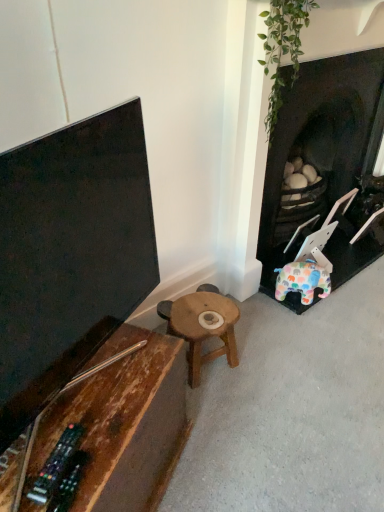
Identify the location of wooden stool at center, the 2th table viewed from the front. (202, 327).

The width and height of the screenshot is (384, 512). What are the coordinates of `dark brown wood fireplace at right` in the screenshot? It's located at (325, 162).

Locate an element on the screen. The width and height of the screenshot is (384, 512). rustic wood table at lower left, marked as the 2th table in a back-to-front arrangement is located at coordinates (122, 425).

Is rustic wood table at lower left, marked as the 2th table in a back-to-front arrangement, positioned far away from dark brown wood fireplace at right?

Absolutely, rustic wood table at lower left, marked as the 2th table in a back-to-front arrangement, is distant from dark brown wood fireplace at right.

Find the location of a particular element. The width and height of the screenshot is (384, 512). fireplace located behind the rustic wood table at lower left, marked as the 2th table in a back-to-front arrangement is located at coordinates (325, 162).

From a real-world perspective, is rustic wood table at lower left, marked as the 2th table in a back-to-front arrangement, physically above dark brown wood fireplace at right?

No, from a real-world perspective, rustic wood table at lower left, marked as the 2th table in a back-to-front arrangement, is not on top of dark brown wood fireplace at right.

Between rustic wood table at lower left, marked as the 2th table in a back-to-front arrangement, and dark brown wood fireplace at right, which one has larger size?

dark brown wood fireplace at right is bigger.

From the image's perspective, is rustic wood table at lower left, the first table in the front-to-back sequence, over wooden stool at center, the 2th table viewed from the front?

No, from the image's perspective, rustic wood table at lower left, the first table in the front-to-back sequence, is not above wooden stool at center, the 2th table viewed from the front.

Can wooden stool at center, the 1th table viewed from the back, be found inside rustic wood table at lower left, the first table in the front-to-back sequence?

That's incorrect, wooden stool at center, the 1th table viewed from the back, is not inside rustic wood table at lower left, the first table in the front-to-back sequence.

Are rustic wood table at lower left, marked as the 2th table in a back-to-front arrangement, and wooden stool at center, the 2th table viewed from the front, far apart?

No, rustic wood table at lower left, marked as the 2th table in a back-to-front arrangement, is in close proximity to wooden stool at center, the 2th table viewed from the front.

Considering the sizes of rustic wood table at lower left, marked as the 2th table in a back-to-front arrangement, and wooden stool at center, the 2th table viewed from the front, in the image, is rustic wood table at lower left, marked as the 2th table in a back-to-front arrangement, wider or thinner than wooden stool at center, the 2th table viewed from the front,?

Considering their sizes, rustic wood table at lower left, marked as the 2th table in a back-to-front arrangement, looks broader than wooden stool at center, the 2th table viewed from the front.

Considering the sizes of objects wooden stool at center, the 2th table viewed from the front, and rustic wood table at lower left, marked as the 2th table in a back-to-front arrangement, in the image provided, who is smaller, wooden stool at center, the 2th table viewed from the front, or rustic wood table at lower left, marked as the 2th table in a back-to-front arrangement,?

With smaller size is wooden stool at center, the 2th table viewed from the front.

In the image, there is a rustic wood table at lower left, marked as the 2th table in a back-to-front arrangement. What are the coordinates of `table below it (from a real-world perspective)` in the screenshot? It's located at (202, 327).

From the image's perspective, which object appears higher, wooden stool at center, the 2th table viewed from the front, or rustic wood table at lower left, the first table in the front-to-back sequence?

wooden stool at center, the 2th table viewed from the front, appears higher in the image.

From the picture: Is wooden stool at center, the 2th table viewed from the front, oriented away from rustic wood table at lower left, the first table in the front-to-back sequence?

wooden stool at center, the 2th table viewed from the front, does not have its back to rustic wood table at lower left, the first table in the front-to-back sequence.

Looking at this image, is dark brown wood fireplace at right not within wooden stool at center, the 2th table viewed from the front?

Absolutely, dark brown wood fireplace at right is external to wooden stool at center, the 2th table viewed from the front.

Based on the photo, between dark brown wood fireplace at right and wooden stool at center, the 2th table viewed from the front, which one has larger width?

dark brown wood fireplace at right is wider.

Is the position of dark brown wood fireplace at right more distant than that of wooden stool at center, the 2th table viewed from the front?

No, it is in front of wooden stool at center, the 2th table viewed from the front.

From a real-world perspective, who is located lower, dark brown wood fireplace at right or wooden stool at center, the 2th table viewed from the front?

wooden stool at center, the 2th table viewed from the front, is physically lower.

From the image's perspective, is dark brown wood fireplace at right located beneath rustic wood table at lower left, marked as the 2th table in a back-to-front arrangement?

No.

Is dark brown wood fireplace at right surrounding rustic wood table at lower left, the first table in the front-to-back sequence?

No, rustic wood table at lower left, the first table in the front-to-back sequence, is located outside of dark brown wood fireplace at right.

Relative to rustic wood table at lower left, the first table in the front-to-back sequence, is dark brown wood fireplace at right in front or behind?

Visually, dark brown wood fireplace at right is located behind rustic wood table at lower left, the first table in the front-to-back sequence.

Which object is positioned more to the left, dark brown wood fireplace at right or rustic wood table at lower left, the first table in the front-to-back sequence?

From the viewer's perspective, rustic wood table at lower left, the first table in the front-to-back sequence, appears more on the left side.

From the image's perspective, which one is positioned higher, wooden stool at center, the 2th table viewed from the front, or dark brown wood fireplace at right?

dark brown wood fireplace at right appears higher in the image.

Who is smaller, wooden stool at center, the 1th table viewed from the back, or dark brown wood fireplace at right?

wooden stool at center, the 1th table viewed from the back, is smaller.

Looking at this image, between wooden stool at center, the 1th table viewed from the back, and dark brown wood fireplace at right, which one is positioned in front?

dark brown wood fireplace at right is in front.

The image size is (384, 512). In order to click on fireplace above the rustic wood table at lower left, marked as the 2th table in a back-to-front arrangement (from the image's perspective) in this screenshot , I will do `click(325, 162)`.

You are a GUI agent. You are given a task and a screenshot of the screen. Output one action in this format:
    pyautogui.click(x=<x>, y=<y>)
    Task: Click on the table in front of the wooden stool at center, the 1th table viewed from the back
    The image size is (384, 512).
    Given the screenshot: What is the action you would take?
    pyautogui.click(x=122, y=425)

Looking at the image, which one is located further to rustic wood table at lower left, marked as the 2th table in a back-to-front arrangement, wooden stool at center, the 2th table viewed from the front, or dark brown wood fireplace at right?

dark brown wood fireplace at right.

Looking at this image, when comparing their distances from dark brown wood fireplace at right, does wooden stool at center, the 1th table viewed from the back, or rustic wood table at lower left, the first table in the front-to-back sequence, seem further?

rustic wood table at lower left, the first table in the front-to-back sequence, is further to dark brown wood fireplace at right.

Which object lies nearer to the anchor point wooden stool at center, the 2th table viewed from the front, rustic wood table at lower left, marked as the 2th table in a back-to-front arrangement, or dark brown wood fireplace at right?

The object closer to wooden stool at center, the 2th table viewed from the front, is rustic wood table at lower left, marked as the 2th table in a back-to-front arrangement.

From the image, which object appears to be farther from wooden stool at center, the 1th table viewed from the back, dark brown wood fireplace at right or rustic wood table at lower left, marked as the 2th table in a back-to-front arrangement?

dark brown wood fireplace at right.

From the image, which object appears to be farther from dark brown wood fireplace at right, rustic wood table at lower left, the first table in the front-to-back sequence, or wooden stool at center, the 1th table viewed from the back?

Among the two, rustic wood table at lower left, the first table in the front-to-back sequence, is located further to dark brown wood fireplace at right.

Looking at the image, which one is located further to rustic wood table at lower left, marked as the 2th table in a back-to-front arrangement, dark brown wood fireplace at right or wooden stool at center, the 2th table viewed from the front?

dark brown wood fireplace at right is positioned further to the anchor rustic wood table at lower left, marked as the 2th table in a back-to-front arrangement.

You are a GUI agent. You are given a task and a screenshot of the screen. Output one action in this format:
    pyautogui.click(x=<x>, y=<y>)
    Task: Click on the table between dark brown wood fireplace at right and rustic wood table at lower left, the first table in the front-to-back sequence, in the vertical direction
    This screenshot has height=512, width=384.
    Given the screenshot: What is the action you would take?
    pyautogui.click(x=202, y=327)